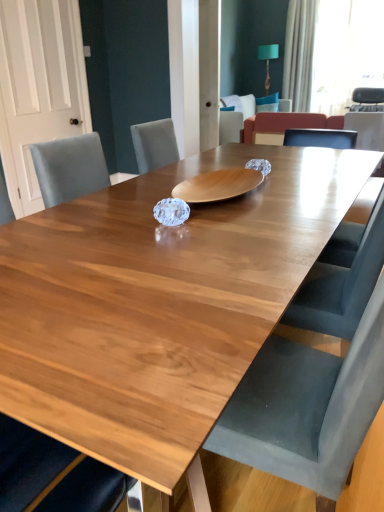
Question: From a real-world perspective, is velvet armchair at upper right, placed as the 2th armchair when sorted from left to right, on velvet armchair at center, the second armchair viewed from the right?

Choices:
 (A) yes
 (B) no

Answer: (A)

Question: Is velvet armchair at upper right, acting as the 1th armchair starting from the right, not inside velvet armchair at center, the second armchair viewed from the right?

Choices:
 (A) no
 (B) yes

Answer: (B)

Question: Is velvet armchair at upper right, acting as the 1th armchair starting from the right, oriented away from velvet armchair at center, the 1th armchair from the left?

Choices:
 (A) no
 (B) yes

Answer: (A)

Question: Are velvet armchair at upper right, placed as the 2th armchair when sorted from left to right, and velvet armchair at center, the 1th armchair from the left, far apart?

Choices:
 (A) yes
 (B) no

Answer: (A)

Question: Is velvet armchair at upper right, acting as the 1th armchair starting from the right, thinner than velvet armchair at center, the 1th armchair from the left?

Choices:
 (A) yes
 (B) no

Answer: (B)

Question: Is velvet armchair at upper right, acting as the 1th armchair starting from the right, positioned before velvet armchair at center, the 1th armchair from the left?

Choices:
 (A) yes
 (B) no

Answer: (B)

Question: Is velvet armchair at center, the 1th armchair from the left, far from wooden table at center?

Choices:
 (A) yes
 (B) no

Answer: (A)

Question: From a real-world perspective, is velvet armchair at center, the second armchair viewed from the right, located higher than wooden table at center?

Choices:
 (A) yes
 (B) no

Answer: (B)

Question: Is velvet armchair at center, the second armchair viewed from the right, at the right side of wooden table at center?

Choices:
 (A) yes
 (B) no

Answer: (A)

Question: Is velvet armchair at center, the second armchair viewed from the right, directly adjacent to wooden table at center?

Choices:
 (A) no
 (B) yes

Answer: (A)

Question: Can you confirm if velvet armchair at center, the second armchair viewed from the right, is thinner than wooden table at center?

Choices:
 (A) no
 (B) yes

Answer: (A)

Question: Is wooden table at center at the back of velvet armchair at center, the 1th armchair from the left?

Choices:
 (A) no
 (B) yes

Answer: (A)

Question: From a real-world perspective, is wooden table at center on white fabric curtain at upper right?

Choices:
 (A) no
 (B) yes

Answer: (A)